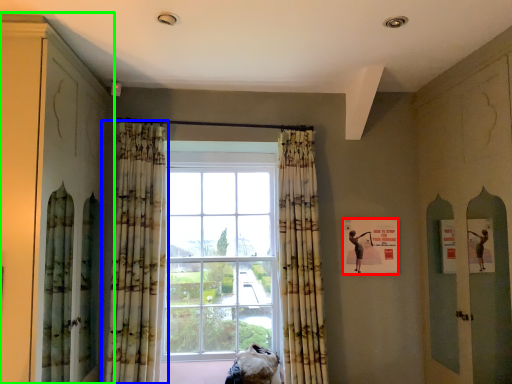
Question: Which object is the closest to the poster (highlighted by a red box)? Choose among these: curtain (highlighted by a blue box) or cabinetry (highlighted by a green box).

Choices:
 (A) curtain
 (B) cabinetry

Answer: (A)